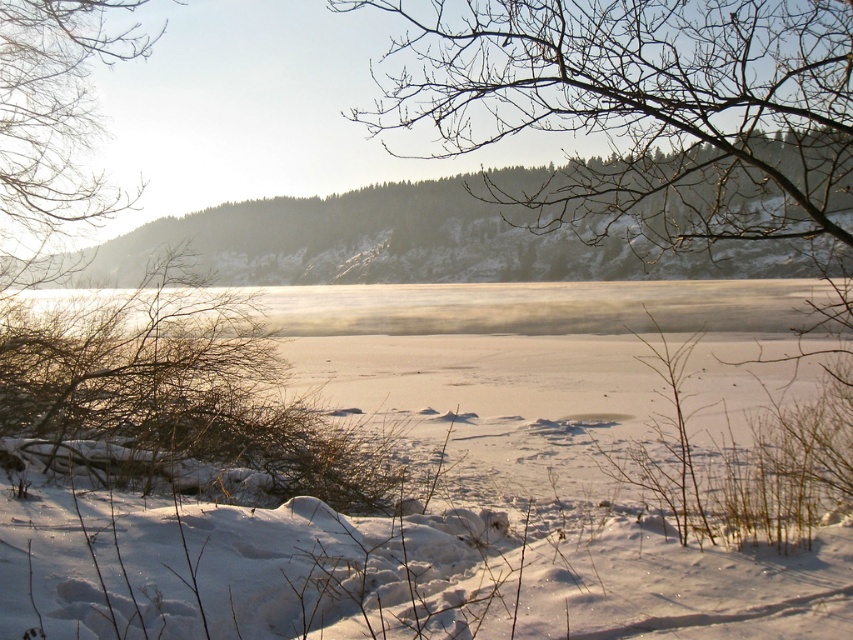
Question: Can you confirm if bare branches at upper center is positioned to the right of green textured hillside at upper center?

Choices:
 (A) no
 (B) yes

Answer: (B)

Question: Which object is the farthest from the bare branches at upper center?

Choices:
 (A) green textured hillside at upper center
 (B) translucent ice at center

Answer: (B)

Question: Can you confirm if bare branches at upper center is wider than green textured hillside at upper center?

Choices:
 (A) no
 (B) yes

Answer: (A)

Question: Among these objects, which one is nearest to the camera?

Choices:
 (A) bare branches at upper center
 (B) translucent ice at center

Answer: (A)

Question: Is bare branches at upper center thinner than green textured hillside at upper center?

Choices:
 (A) yes
 (B) no

Answer: (A)

Question: Which point is closer to the camera?

Choices:
 (A) (490, 227)
 (B) (477, 144)

Answer: (B)